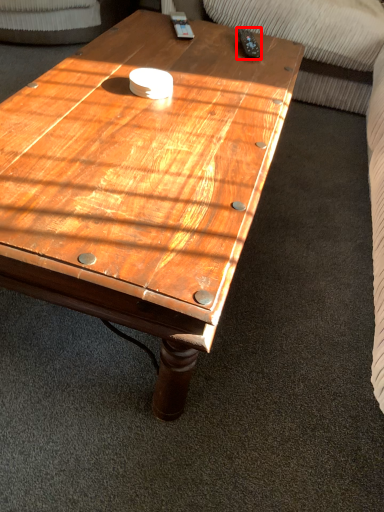
Question: From the image's perspective, what is the correct spatial relationship of remote (annotated by the red box) in relation to coffee table?

Choices:
 (A) below
 (B) above

Answer: (B)